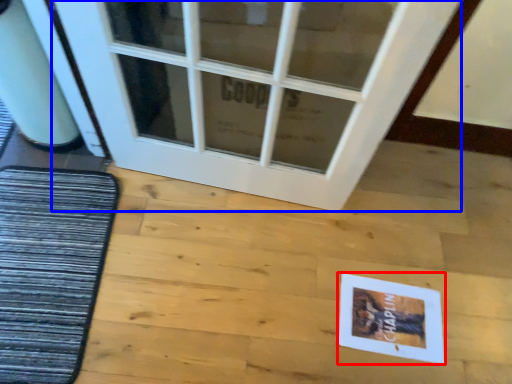
Question: Which point is further to the camera, postcard (highlighted by a red box) or door (highlighted by a blue box)?

Choices:
 (A) postcard
 (B) door

Answer: (A)